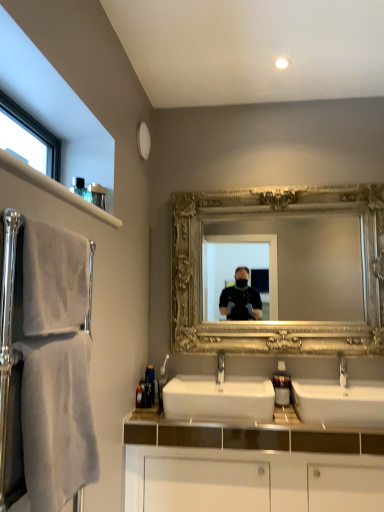
Identify the location of vacant area that is in front of matte brown soap dispenser at lower left, which is the 2th toiletry from back to front. (147, 415).